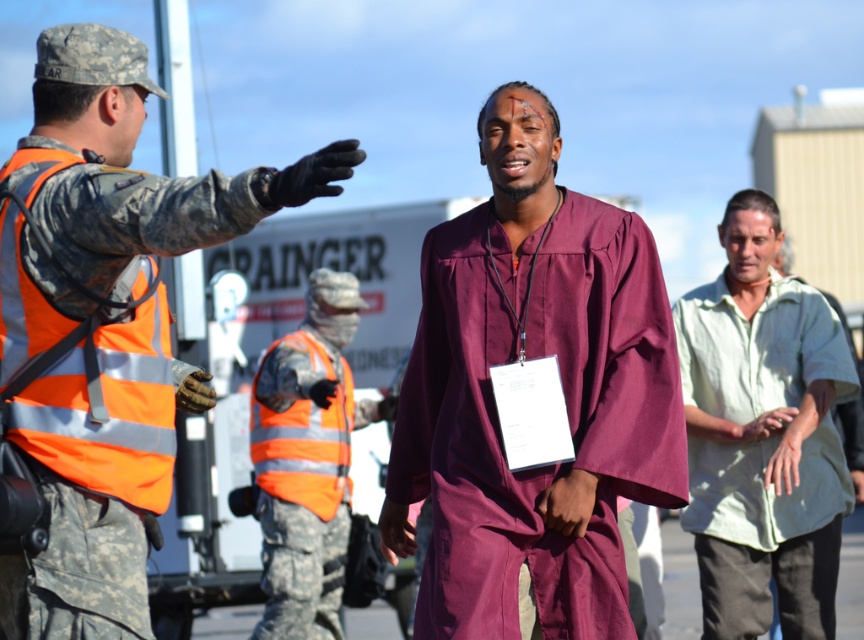
Question: Which is nearer to the reflective orange safety vest at center?

Choices:
 (A) camouflage fabric uniform at center
 (B) camouflage uniform at left
 (C) maroon fabric jumpsuit at center
 (D) light green cotton shirt at right

Answer: (A)

Question: Estimate the real-world distances between objects in this image. Which object is closer to the camouflage fabric uniform at center?

Choices:
 (A) orange reflective safety vest at left
 (B) light green cotton shirt at right
 (C) camouflage uniform at left

Answer: (B)

Question: Does maroon fabric jumpsuit at center lie in front of camouflage fabric uniform at center?

Choices:
 (A) yes
 (B) no

Answer: (A)

Question: Can you confirm if maroon fabric jumpsuit at center is bigger than camouflage fabric uniform at center?

Choices:
 (A) yes
 (B) no

Answer: (B)

Question: Is maroon fabric jumpsuit at center smaller than light green cotton shirt at right?

Choices:
 (A) no
 (B) yes

Answer: (A)

Question: Which point is farther to the camera?

Choices:
 (A) (30, 154)
 (B) (337, 285)
 (C) (725, 397)
 (D) (630, 490)

Answer: (B)